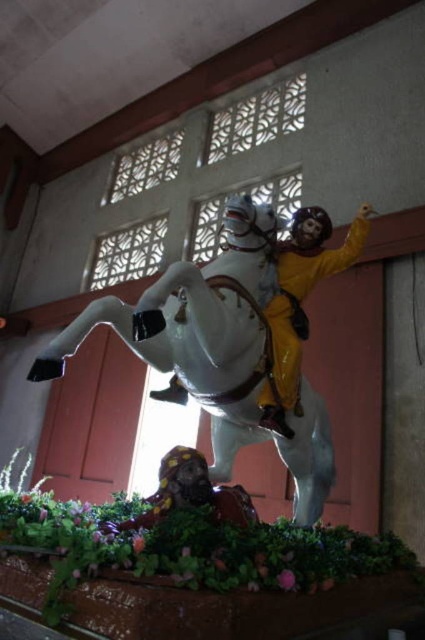
Question: Estimate the real-world distances between objects in this image. Which object is closer to the yellow matte figure at upper center?

Choices:
 (A) glossy white horse at center
 (B) smooth yellow helmet at lower center

Answer: (A)

Question: Can you confirm if glossy white horse at center is positioned above smooth yellow helmet at lower center?

Choices:
 (A) yes
 (B) no

Answer: (A)

Question: Does yellow matte figure at upper center appear on the left side of smooth yellow helmet at lower center?

Choices:
 (A) no
 (B) yes

Answer: (A)

Question: Does glossy white horse at center appear on the left side of smooth yellow helmet at lower center?

Choices:
 (A) yes
 (B) no

Answer: (B)

Question: Estimate the real-world distances between objects in this image. Which object is farther from the yellow matte figure at upper center?

Choices:
 (A) glossy white horse at center
 (B) smooth yellow helmet at lower center

Answer: (B)

Question: Which point is farther to the camera?

Choices:
 (A) glossy white horse at center
 (B) smooth yellow helmet at lower center

Answer: (A)